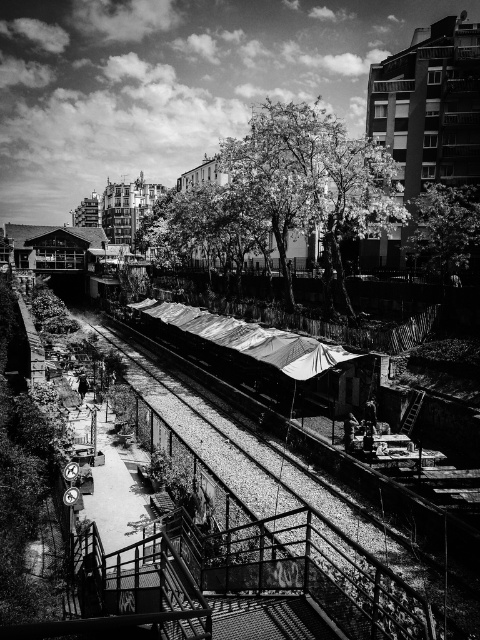
Measure the distance from smooth bark tree at center to metallic corrugated roof at center.

28.01 meters

Between smooth bark tree at center and metallic corrugated roof at center, which one appears on the left side from the viewer's perspective?

From the viewer's perspective, metallic corrugated roof at center appears more on the left side.

Who is more distant from viewer, (232, 182) or (228, 349)?

The point (232, 182) is more distant.

This screenshot has height=640, width=480. Identify the location of smooth bark tree at center. (291, 192).

Between metallic corrugated roof at center and smooth green tree at upper right, which one is positioned lower?

metallic corrugated roof at center is lower down.

From the picture: Can you confirm if metallic corrugated roof at center is positioned to the left of smooth green tree at upper right?

Indeed, metallic corrugated roof at center is positioned on the left side of smooth green tree at upper right.

Which is in front, point (240, 362) or point (453, 240)?

Point (453, 240) is more forward.

Where is `metallic corrugated roof at center`? Image resolution: width=480 pixels, height=640 pixels. metallic corrugated roof at center is located at coordinates (245, 348).

Who is more distant from viewer, (290, 120) or (467, 230)?

Point (290, 120)

Which is below, smooth bark tree at center or smooth green tree at upper right?

smooth green tree at upper right

Which is in front, point (243, 248) or point (453, 232)?

Point (453, 232)

Where is `smooth bark tree at center`? This screenshot has height=640, width=480. smooth bark tree at center is located at coordinates pyautogui.click(x=291, y=192).